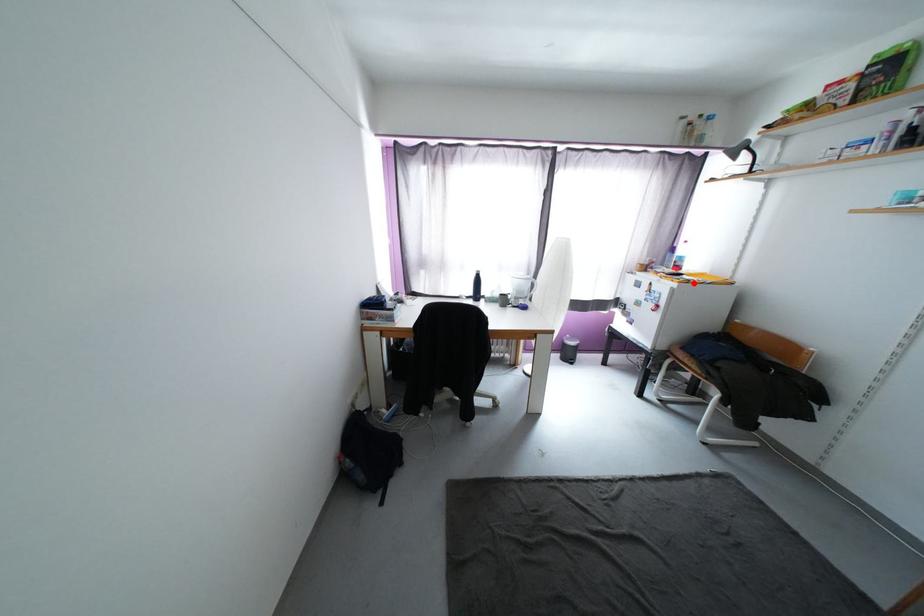
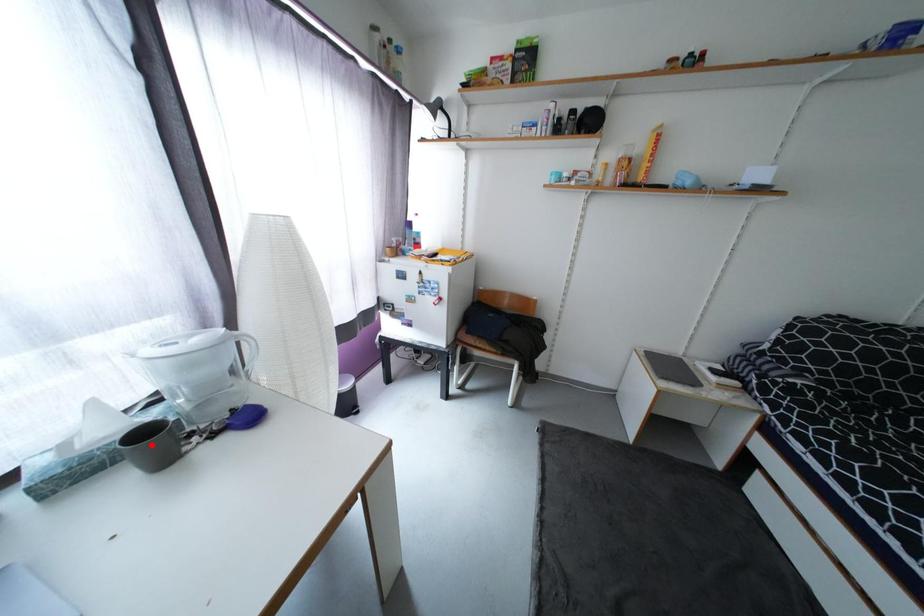
I am providing you with two images of the same scene from different viewpoints. A red point is marked on the first image and another point is marked on the second image. Does the point marked in image1 correspond to the same location as the one in image2?

No